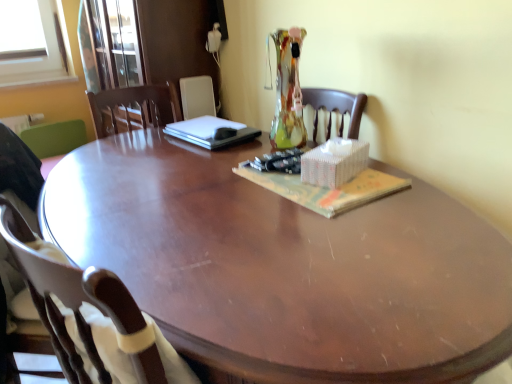
Identify the location of free point above glossy wood desk at center (from a real-world perspective). (216, 200).